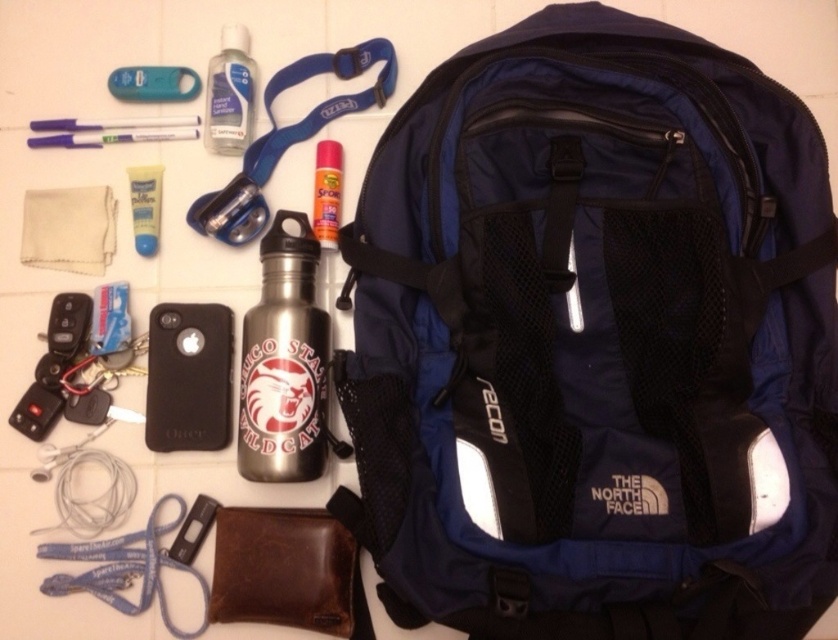
Question: Is brushed metal water bottle at center wider than clear plastic bottle at upper center?

Choices:
 (A) no
 (B) yes

Answer: (B)

Question: Which point is closer to the camera?

Choices:
 (A) metallic silver spray can at center
 (B) navy blue fabric backpack at upper center
 (C) brushed metal water bottle at center

Answer: (B)

Question: Which object is positioned farthest from the brushed metal water bottle at center?

Choices:
 (A) navy blue fabric backpack at upper center
 (B) teal plastic keychain at upper left
 (C) black plastic usb drive at lower left
 (D) metallic silver spray can at center

Answer: (B)

Question: Can you confirm if brushed metal water bottle at center is wider than clear plastic bottle at upper center?

Choices:
 (A) no
 (B) yes

Answer: (B)

Question: Which object is positioned farthest from the clear plastic bottle at upper center?

Choices:
 (A) teal plastic keychain at upper left
 (B) black rubber phone case at lower left
 (C) navy blue fabric backpack at upper center
 (D) black plastic usb drive at lower left

Answer: (C)

Question: Can you confirm if navy blue fabric backpack at upper center is positioned to the right of black plastic usb drive at lower left?

Choices:
 (A) yes
 (B) no

Answer: (A)